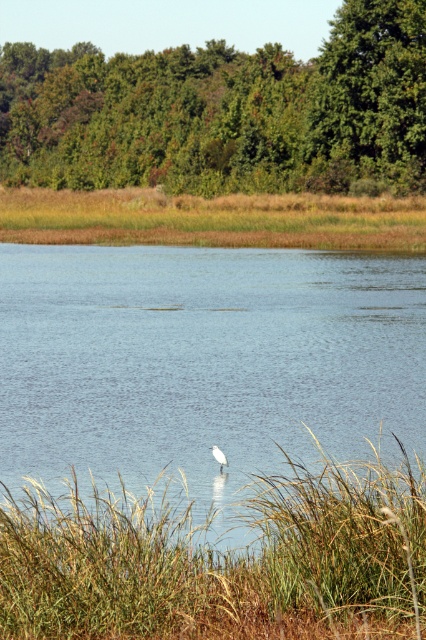
Question: Does brown grass at upper center have a smaller size compared to white matte bird at center?

Choices:
 (A) no
 (B) yes

Answer: (A)

Question: Can you confirm if green leafy trees at upper center is wider than green grass at center?

Choices:
 (A) no
 (B) yes

Answer: (B)

Question: Which object is positioned closest to the brown grass at upper center?

Choices:
 (A) green leafy trees at upper center
 (B) green leafy tree at upper center
 (C) white matte bird at center

Answer: (B)

Question: Is clear water at center in front of green leafy trees at upper center?

Choices:
 (A) yes
 (B) no

Answer: (A)

Question: Based on their relative distances, which object is farther from the green leafy tree at upper center?

Choices:
 (A) green grass at center
 (B) green leafy trees at upper center
 (C) white matte bird at center
 (D) brown grass at upper center

Answer: (A)

Question: Which of the following is the farthest from the observer?

Choices:
 (A) (150, 531)
 (B) (345, 160)
 (C) (109, 305)
 (D) (221, 461)

Answer: (B)